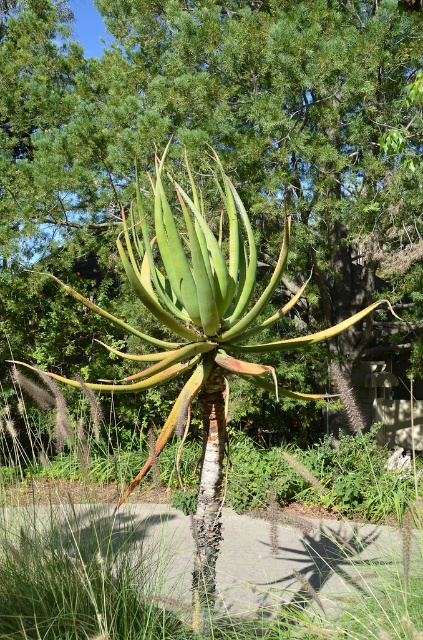
Question: Does green succulent at center appear on the left side of green grass at center?

Choices:
 (A) yes
 (B) no

Answer: (B)

Question: Among these objects, which one is farthest from the camera?

Choices:
 (A) green succulent at center
 (B) green grass at center

Answer: (A)

Question: Is green succulent at center above green grass at center?

Choices:
 (A) no
 (B) yes

Answer: (B)

Question: In this image, where is green succulent at center located relative to green grass at center?

Choices:
 (A) above
 (B) below

Answer: (A)